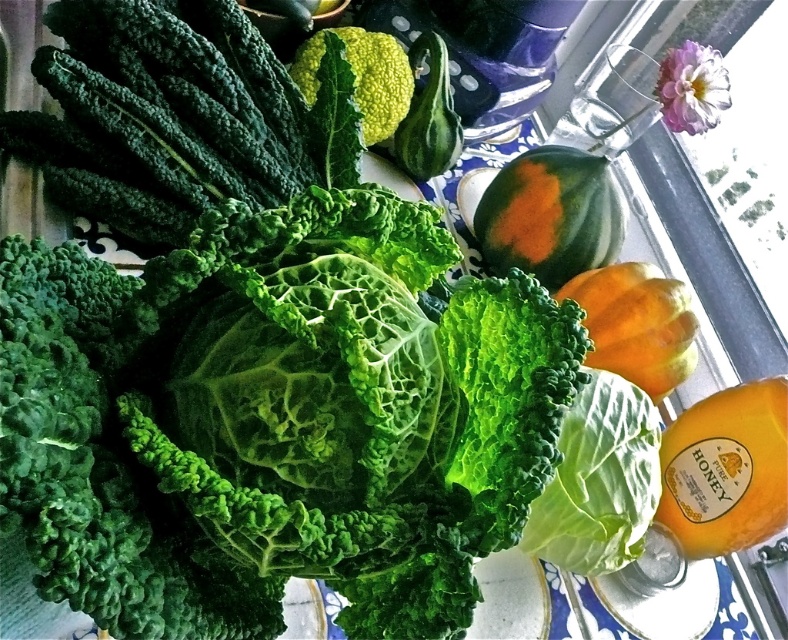
Question: Based on their relative distances, which object is farther from the green leafy at center?

Choices:
 (A) orange-fleshed squash at center
 (B) orange matte pumpkin at right
 (C) green textured broccoli at center

Answer: (C)

Question: Where is green leafy at center located in relation to orange-fleshed squash at center in the image?

Choices:
 (A) above
 (B) below

Answer: (B)

Question: Does green leafy at center appear on the right side of green textured broccoli at center?

Choices:
 (A) no
 (B) yes

Answer: (B)

Question: Does translucent glass bottle of orange juice at lower right appear on the left side of green textured broccoli at center?

Choices:
 (A) no
 (B) yes

Answer: (A)

Question: Among these points, which one is nearest to the camera?

Choices:
 (A) coord(372,131)
 (B) coord(779,445)
 (C) coord(634,344)

Answer: (B)

Question: Among these objects, which one is farthest from the camera?

Choices:
 (A) green matte squash at center
 (B) translucent glass bottle of orange juice at lower right

Answer: (A)